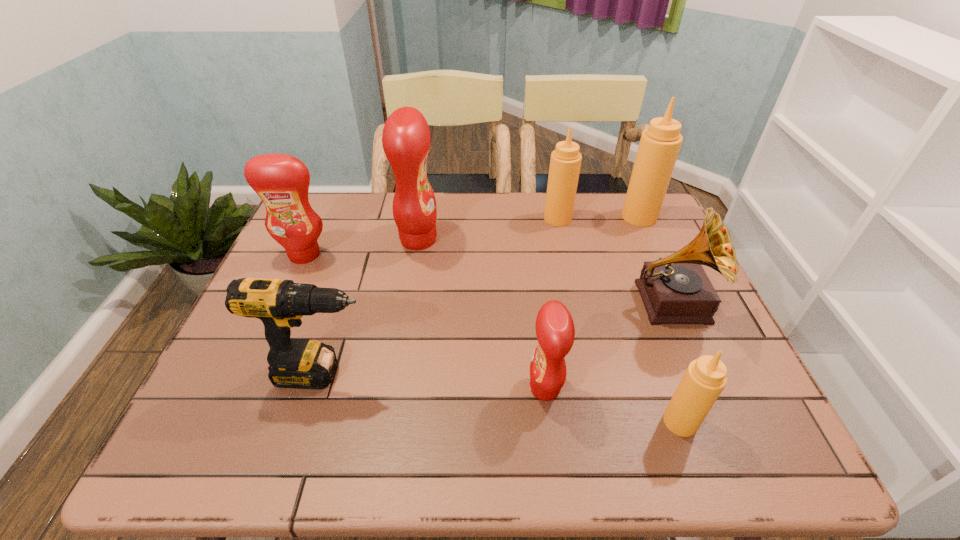
Where is `object located in the near right corner section of the desktop`? The image size is (960, 540). object located in the near right corner section of the desktop is located at coordinates (705, 378).

In the image, there is a desktop. Identify the location of vacant space at the far edge. click(565, 227).

Image resolution: width=960 pixels, height=540 pixels. I want to click on free location at the near edge, so click(x=622, y=449).

Find the location of a particular element. This screenshot has width=960, height=540. vacant space at the left edge of the desktop is located at coordinates tap(321, 282).

Find the location of a particular element. free spot at the right edge of the desktop is located at coordinates (638, 251).

At what (x,y) coordinates should I click in order to perform the action: click on empty space between the leftmost condiment and the brown phonograph record. Please return your answer as a coordinate pair (x, y). Image resolution: width=960 pixels, height=540 pixels. Looking at the image, I should click on (488, 278).

Where is `empty space that is in between the fourth condiment from left to right and the drill`? The height and width of the screenshot is (540, 960). empty space that is in between the fourth condiment from left to right and the drill is located at coordinates (440, 296).

This screenshot has width=960, height=540. Identify the location of vacant space that is in between the second red condiment from left to right and the black drill. (371, 306).

This screenshot has width=960, height=540. I want to click on unoccupied area between the third condiment from right to left and the second red condiment from left to right, so click(488, 229).

Locate an element on the screen. Image resolution: width=960 pixels, height=540 pixels. vacant area that lies between the fourth condiment from left to right and the rightmost condiment is located at coordinates (598, 218).